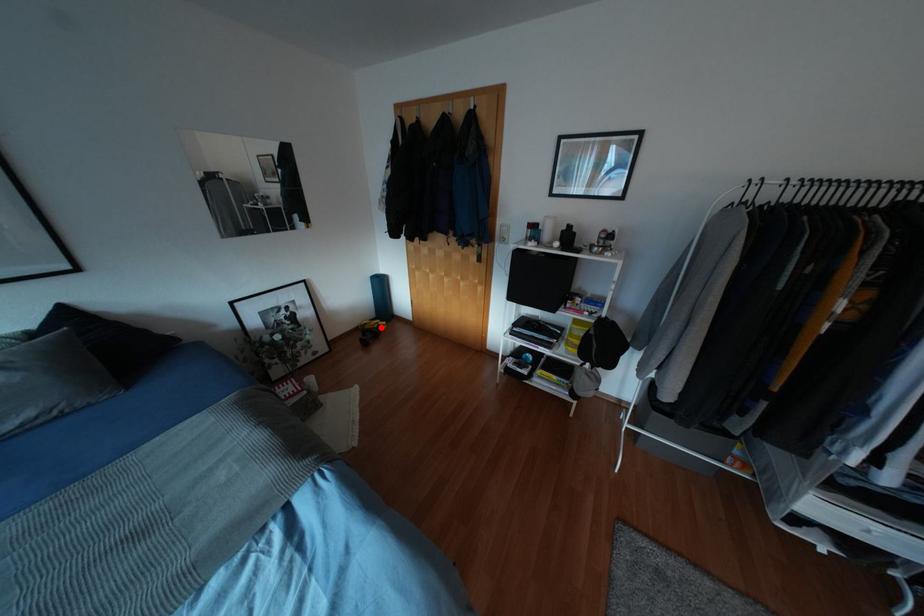
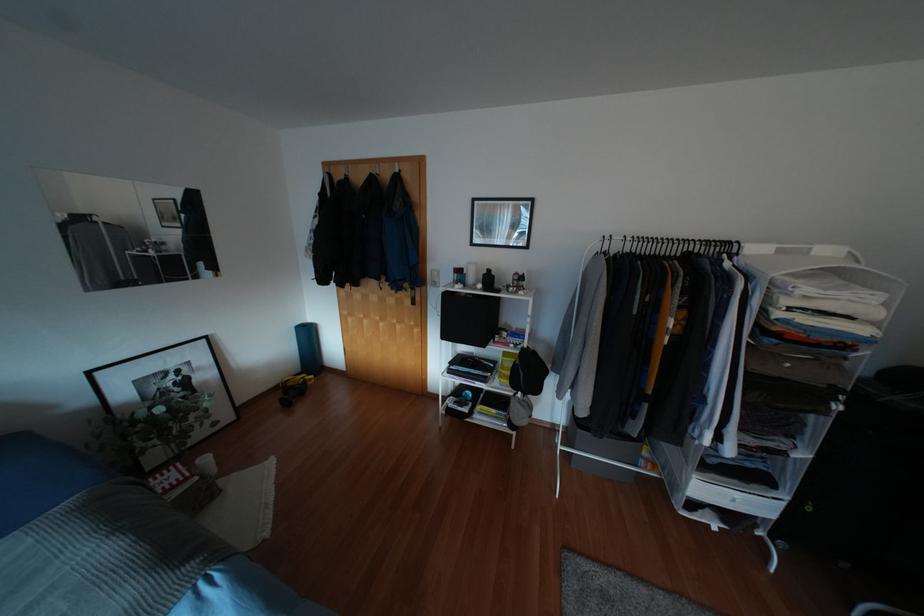
Question: A red point is marked in image1. In image2, is the corresponding 3D point closer to the camera or farther? Reply with the corresponding letter.

Choices:
 (A) The corresponding 3D point is closer.
 (B) The corresponding 3D point is farther.

Answer: (B)